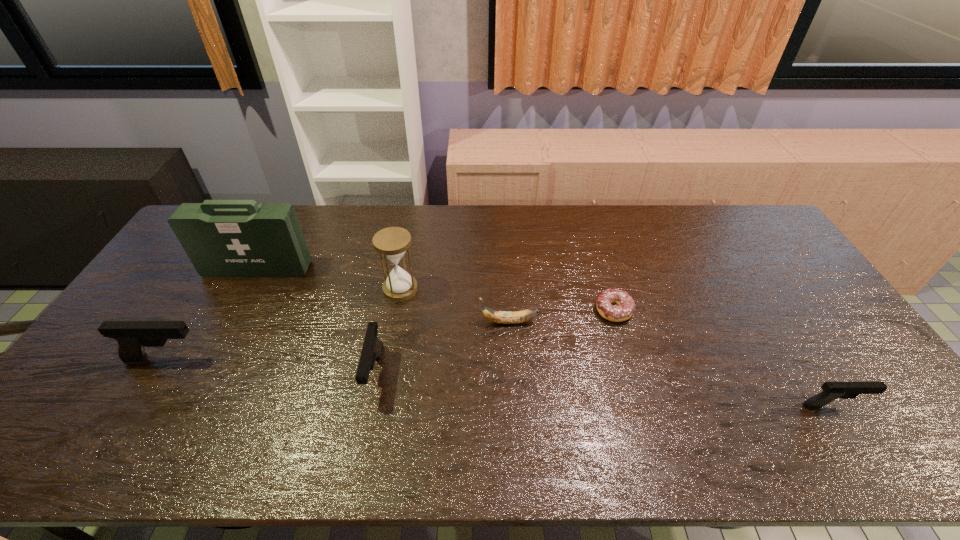
Locate which pistol is the closest to the second shortest pistol. Please provide its 2D coordinates. Your answer should be formatted as a tuple, i.e. [(x, y)], where the tuple contains the x and y coordinates of a point satisfying the conditions above.

[(132, 337)]

I want to click on pistol that is the second closest one to the third tallest object, so click(x=831, y=391).

The image size is (960, 540). In order to click on free point that satisfies the following two spatial constraints: 1. on the front-facing side of the tallest object; 2. on the front-facing side of the fifth shortest object in this screenshot , I will do `click(210, 359)`.